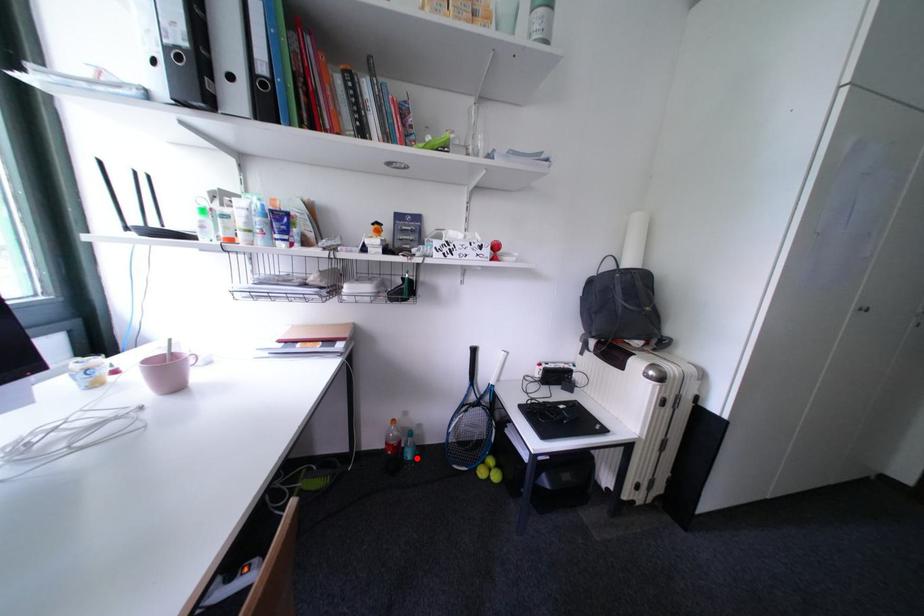
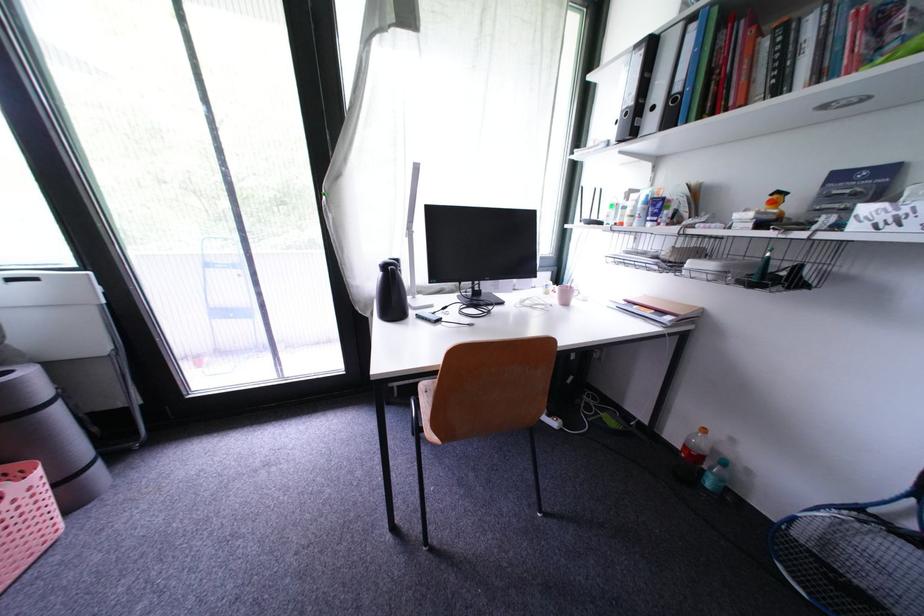
Question: A red point is marked in image1. In image2, is the corresponding 3D point closer to the camera or farther? Reply with the corresponding letter.

Choices:
 (A) The corresponding 3D point is closer.
 (B) The corresponding 3D point is farther.

Answer: (A)